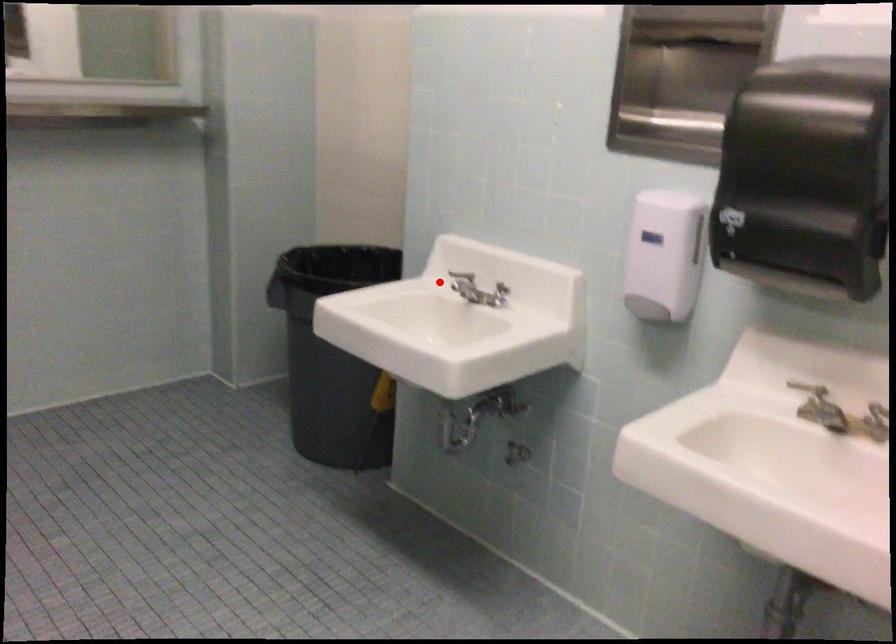
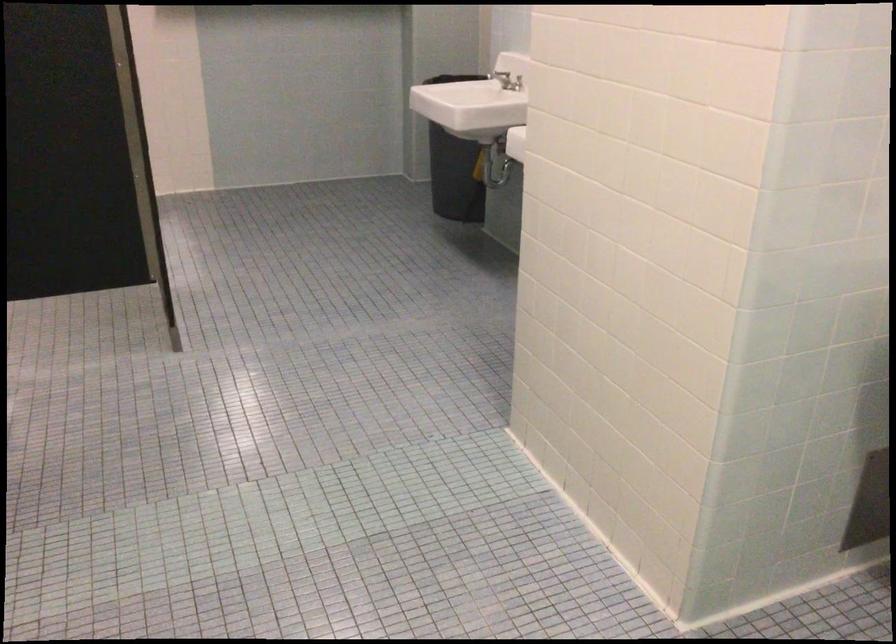
Question: I am providing you with two images of the same scene from different viewpoints. In image1, a red point is highlighted. Considering the same 3D point in image2, which of the following is correct?

Choices:
 (A) It is closer
 (B) It is farther

Answer: (B)